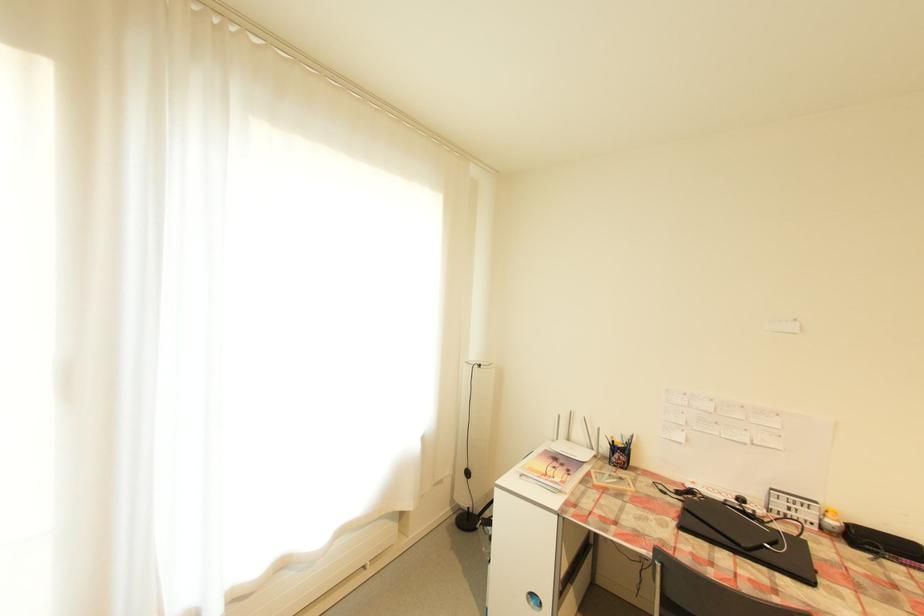
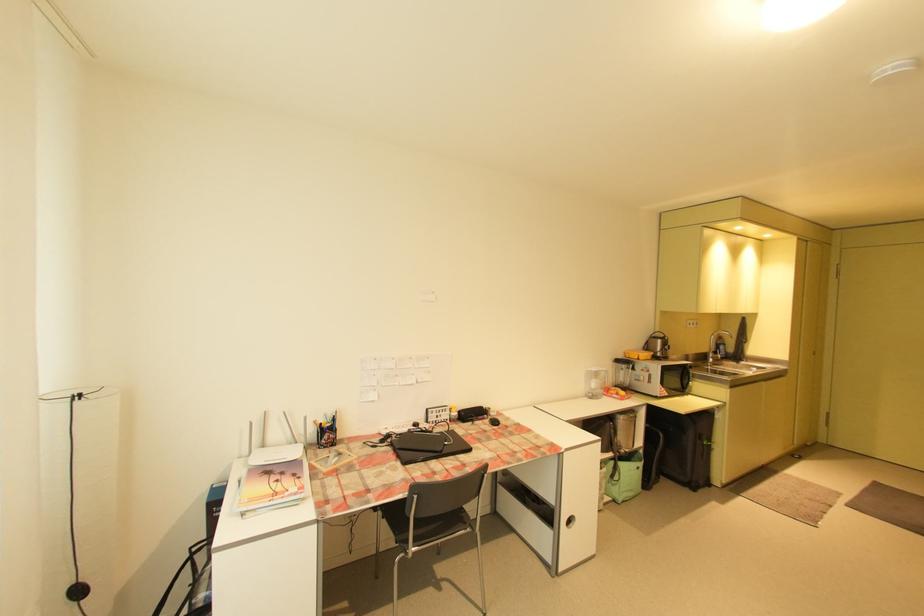
Question: The camera is either moving clockwise (left) or counter-clockwise (right) around the object. The first image is from the beginning of the video and the second image is from the end. Is the camera moving left or right when shooting the video?

Choices:
 (A) Left
 (B) Right

Answer: (A)